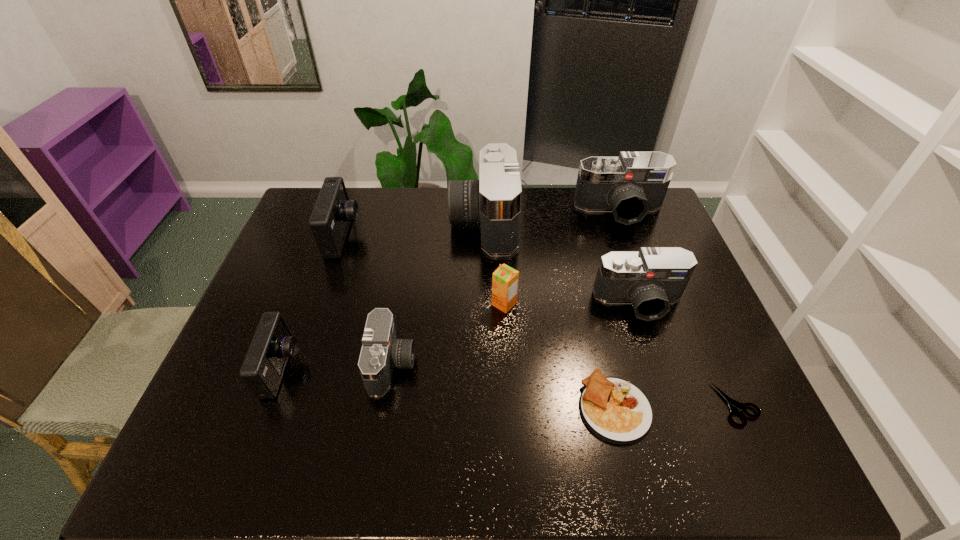
This screenshot has width=960, height=540. What are the coordinates of `free space that satisfies the following two spatial constraints: 1. on the front-facing side of the omelet; 2. on the left side of the smaller blue camera` in the screenshot? It's located at (269, 407).

I want to click on blank area in the image that satisfies the following two spatial constraints: 1. on the front-facing side of the nearer blue camera; 2. on the back side of the second shortest object, so click(x=269, y=407).

This screenshot has height=540, width=960. I want to click on vacant space that satisfies the following two spatial constraints: 1. on the front-facing side of the shears; 2. on the left side of the smallest black camera, so click(385, 404).

The image size is (960, 540). In order to click on vacant point that satisfies the following two spatial constraints: 1. on the front-facing side of the third biggest black camera; 2. on the left side of the shears in this screenshot , I will do `click(674, 404)`.

The width and height of the screenshot is (960, 540). In order to click on free location that satisfies the following two spatial constraints: 1. on the front-facing side of the second biggest black camera; 2. on the front-facing side of the tallest camera in this screenshot , I will do `click(623, 221)`.